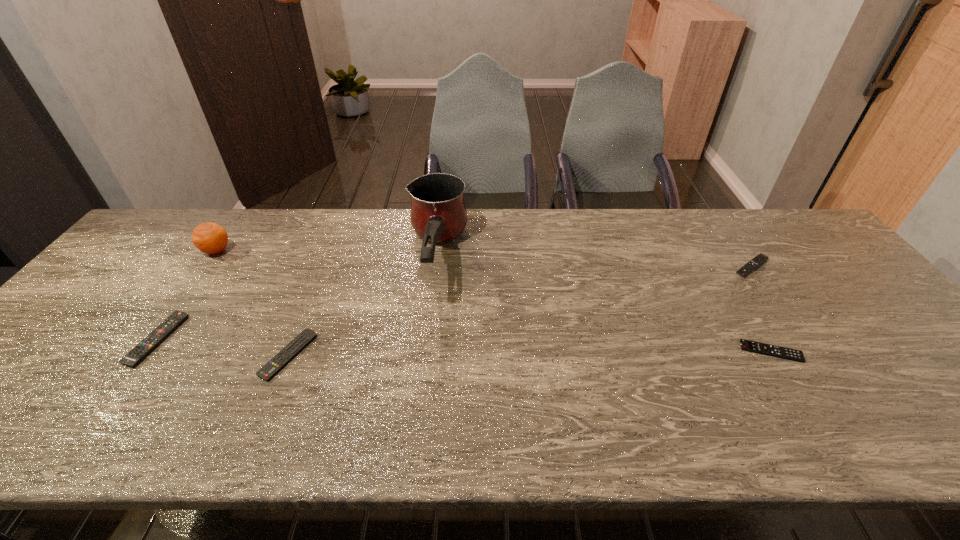
Image resolution: width=960 pixels, height=540 pixels. In order to click on vacant space located on the back of the leftmost remote control in this screenshot , I will do `click(201, 277)`.

Where is `free space located on the front of the second remote control from left to right`? Image resolution: width=960 pixels, height=540 pixels. free space located on the front of the second remote control from left to right is located at coordinates (262, 418).

At what (x,y) coordinates should I click in order to perform the action: click on free space located 0.050m on the right of the shortest remote control. Please return your answer as a coordinate pair (x, y). Looking at the image, I should click on (821, 352).

The image size is (960, 540). Find the location of `saucepan at the far edge`. saucepan at the far edge is located at coordinates (438, 212).

Find the location of a particular element. The image size is (960, 540). orange situated at the far edge is located at coordinates (210, 238).

Find the location of a particular element. vacant space at the far edge of the desktop is located at coordinates pos(748,254).

In the image, there is a desktop. Identify the location of vacant space at the near edge. This screenshot has height=540, width=960. (703, 437).

This screenshot has width=960, height=540. In order to click on vacant space at the left edge in this screenshot , I will do `click(117, 324)`.

What are the coordinates of `vacant space in between the leftmost remote control and the fourth object from left to right` in the screenshot? It's located at (297, 299).

Locate an element on the screen. vacant space that's between the third remote control from right to left and the farthest remote control is located at coordinates pyautogui.click(x=519, y=311).